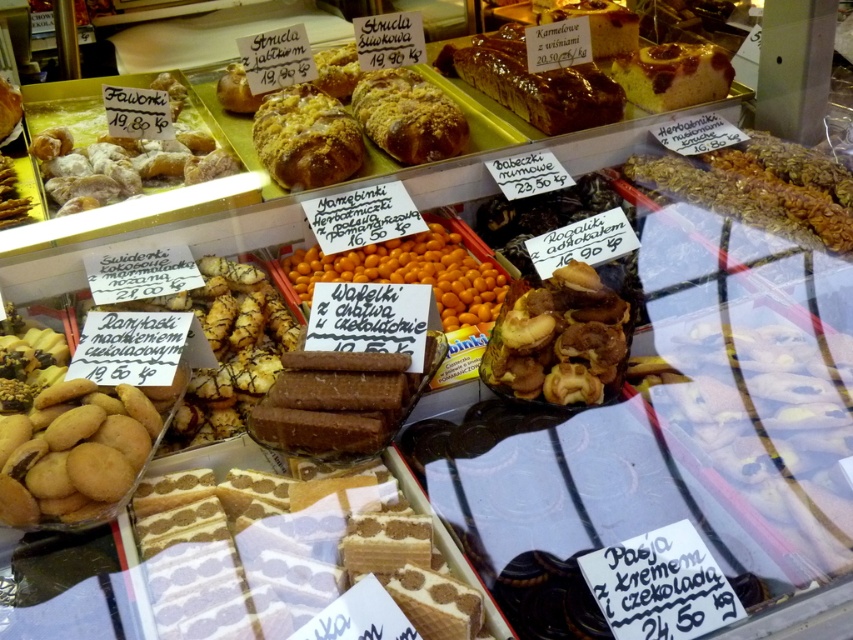
Looking at this image, does granular textured nuts at upper right have a greater width compared to golden crumbly bun at upper center?

Yes.

Is granular textured nuts at upper right smaller than golden crumbly bun at upper center?

No, granular textured nuts at upper right is not smaller than golden crumbly bun at upper center.

Who is more distant from viewer, (840, 216) or (338, 100)?

The point (338, 100) is more distant.

Find the location of a particular element. This screenshot has height=640, width=853. granular textured nuts at upper right is located at coordinates [761, 188].

Which is more to the right, white creamy cake at center or golden crumbly loaf at center?

From the viewer's perspective, golden crumbly loaf at center appears more on the right side.

Which is behind, point (424, 554) or point (379, 68)?

Point (379, 68)

Image resolution: width=853 pixels, height=640 pixels. Find the location of `white creamy cake at center`. white creamy cake at center is located at coordinates (310, 548).

Can you confirm if golden crumbly bun at upper center is positioned to the left of golden crumbly loaf at center?

Correct, you'll find golden crumbly bun at upper center to the left of golden crumbly loaf at center.

Who is more distant from viewer, (274, 120) or (456, 129)?

The point (274, 120) is behind.

Is point (265, 145) closer to viewer compared to point (405, 132)?

No, it is not.

The height and width of the screenshot is (640, 853). In order to click on golden crumbly bun at upper center in this screenshot , I will do `click(306, 138)`.